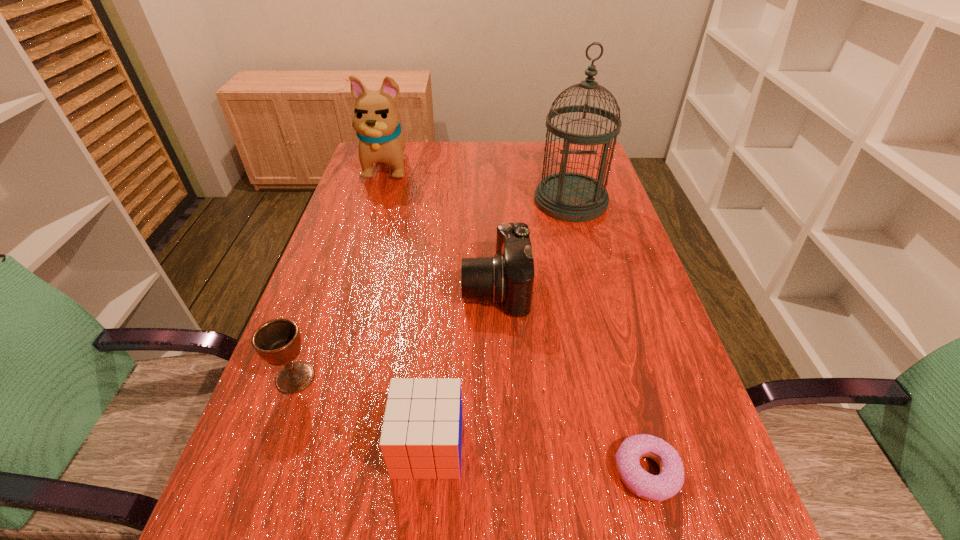
The width and height of the screenshot is (960, 540). What are the coordinates of `vacant area that lies between the fourth nearest object and the tallest object` in the screenshot? It's located at (533, 244).

Identify the location of unoccupied position between the cube and the camera. The image size is (960, 540). (462, 367).

The height and width of the screenshot is (540, 960). I want to click on vacant space that's between the fourth farthest object and the birdcage, so click(x=433, y=289).

Image resolution: width=960 pixels, height=540 pixels. In order to click on object that can be found as the fourth closest to the cube in this screenshot , I will do `click(567, 196)`.

Identify which object is the fourth closest to the third farthest object. Please provide its 2D coordinates. Your answer should be formatted as a tuple, i.e. [(x, y)], where the tuple contains the x and y coordinates of a point satisfying the conditions above.

[(668, 483)]

Find the location of `free space that satisfies the following two spatial constraints: 1. on the lens of the third farthest object; 2. on the front side of the fourth farthest object`. free space that satisfies the following two spatial constraints: 1. on the lens of the third farthest object; 2. on the front side of the fourth farthest object is located at coordinates (499, 377).

Image resolution: width=960 pixels, height=540 pixels. Identify the location of free spot that satisfies the following two spatial constraints: 1. on the front-facing side of the birdcage; 2. on the right side of the doughnut. (644, 472).

The height and width of the screenshot is (540, 960). In order to click on free location that satisfies the following two spatial constraints: 1. on the lens of the fourth nearest object; 2. on the front side of the cube in this screenshot , I will do `click(501, 446)`.

Locate an element on the screen. free space that satisfies the following two spatial constraints: 1. on the front-facing side of the birdcage; 2. on the lens of the camera is located at coordinates (594, 287).

The width and height of the screenshot is (960, 540). I want to click on vacant space that satisfies the following two spatial constraints: 1. on the front-facing side of the doughnut; 2. on the left side of the tallest object, so (644, 472).